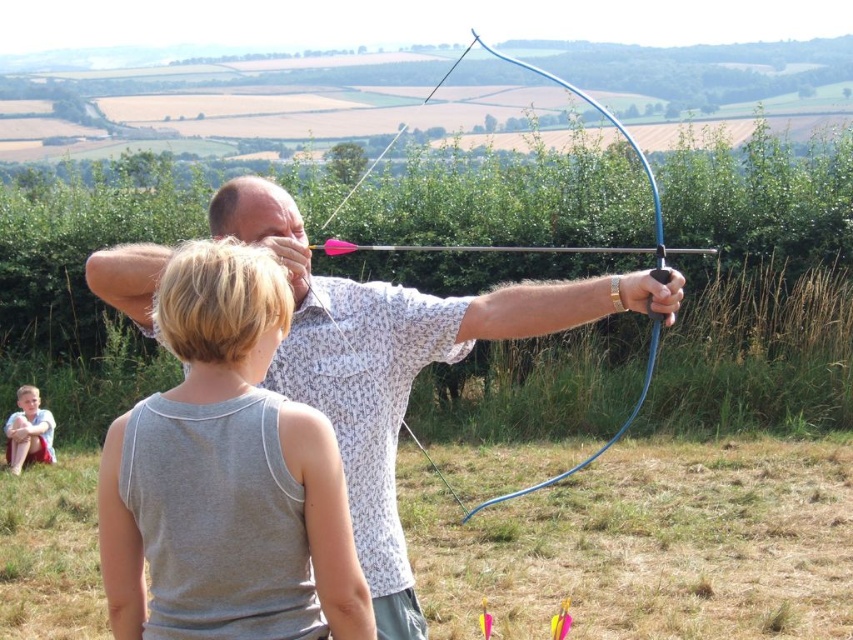
Consider the image. You are an observer standing in front of the archery scene. You notice the gray cotton tank top at center and the light brown fabric shorts at lower left. Which clothing item is located more to the right side?

The gray cotton tank top at center is positioned on the right side of light brown fabric shorts at lower left, so the gray cotton tank top at center is more to the right side.

You are an archery instructor preparing to teach a class. You have a matte blue bow at center and light brown fabric shorts at lower left in your equipment list. Which item should you choose if you need to demonstrate with the bigger object?

You should choose the matte blue bow at center because it is larger in size than the light brown fabric shorts at lower left.

You are an archery instructor preparing to set up a safety zone for a beginner. The gray cotton tank top at center and the light brown fabric shorts at lower left are two markers you have. If the required safety distance is 10 meters between markers, will these two markers meet the requirement?

The distance between the gray cotton tank top at center and the light brown fabric shorts at lower left is 8.91 meters, which is less than the required 10 meters. Therefore, these markers do not meet the safety distance requirement.